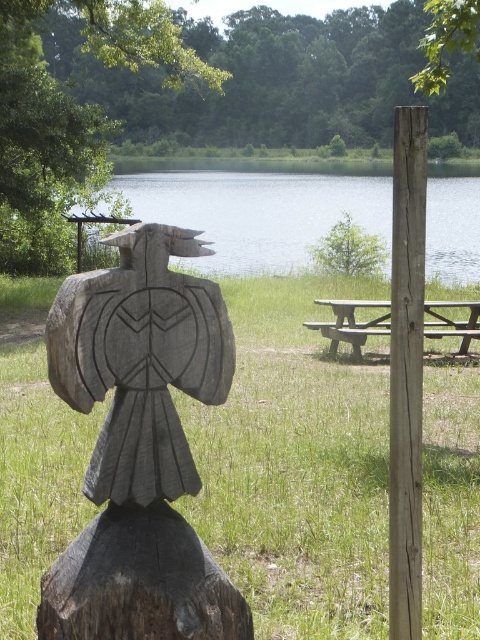
Question: Which object appears farthest from the camera in this image?

Choices:
 (A) green rough grass at center
 (B) dark wood carving at center
 (C) carved stone bird at center
 (D) wooden picnic table at center

Answer: (D)

Question: Which point is farther to the camera?

Choices:
 (A) pos(276,180)
 (B) pos(417,148)

Answer: (A)

Question: Does clear blue water at upper center appear on the right side of wooden picnic table at center?

Choices:
 (A) no
 (B) yes

Answer: (A)

Question: Which of these objects is positioned closest to the smooth wood post at right?

Choices:
 (A) clear blue water at upper center
 (B) green wood tree at upper center
 (C) green rough grass at center
 (D) dark wood carving at center

Answer: (D)

Question: Can you confirm if dark wood carving at center is smaller than smooth wood post at right?

Choices:
 (A) yes
 (B) no

Answer: (A)

Question: From the image, what is the correct spatial relationship of green rough grass at center in relation to green wood tree at upper center?

Choices:
 (A) below
 (B) above

Answer: (A)